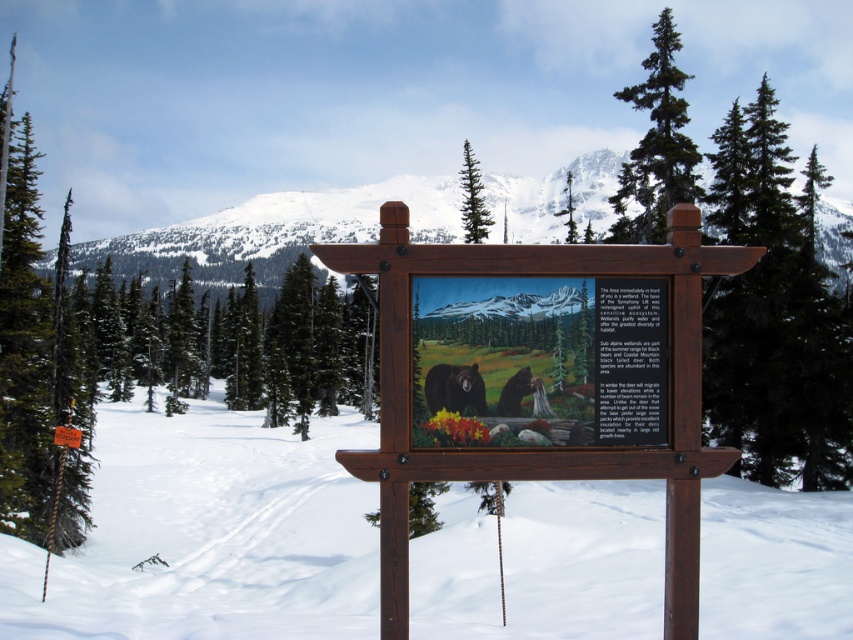
You are a hiker trying to decide whether to take a photo of the wooden signboard at center and the green coniferous tree at center. Since you want both to be clearly visible in the photo, which object should you focus on to ensure both are in frame?

The wooden signboard at center is smaller than the green coniferous tree at center, so you should focus on the green coniferous tree at center to ensure both are in frame.

You are standing at the origin point of the coordinate system. You want to move towards the wooden signboard at center. What direction should you move in to reach it?

Since the wooden signboard at center is located at coordinate point (630,362), you should move northeast to reach it.

You are a snowboarder approaching the wooden signboard at center. You need to stop before reaching it. If your stopping distance is 15 feet, will you be able to stop in time?

The distance between you and the wooden signboard at center is 16.81 feet. Since your stopping distance is 15 feet, you will not be able to stop in time before reaching the wooden signboard at center.